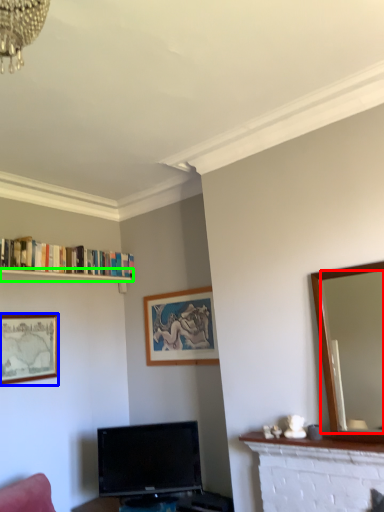
Question: Considering the real-world distances, which object is farthest from mirror (highlighted by a red box)? picture frame (highlighted by a blue box) or shelf (highlighted by a green box)?

Choices:
 (A) picture frame
 (B) shelf

Answer: (B)